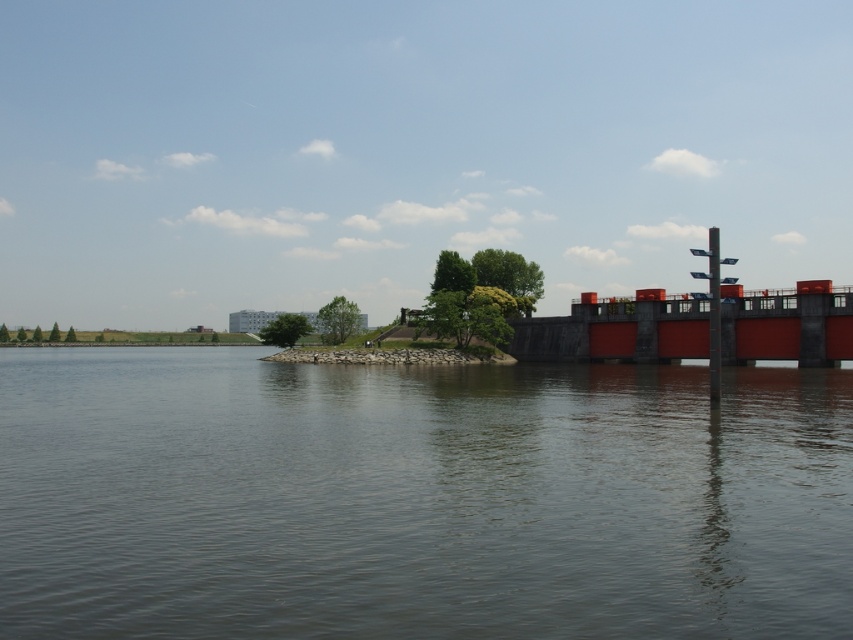
Is smooth water at center positioned in front of matte red bridge at right?

Yes, it is.

Which is in front, point (727, 406) or point (804, 296)?

Point (727, 406)

Describe the element at coordinates (416, 499) in the screenshot. I see `smooth water at center` at that location.

The width and height of the screenshot is (853, 640). In order to click on smooth water at center in this screenshot , I will do `click(416, 499)`.